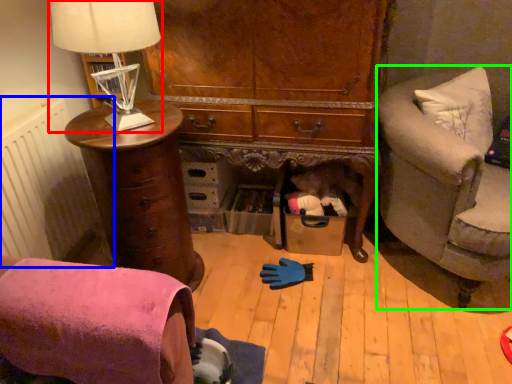
Question: Based on their relative distances, which object is farther from table lamp (highlighted by a red box)? Choose from radiator (highlighted by a blue box) and studio couch (highlighted by a green box).

Choices:
 (A) radiator
 (B) studio couch

Answer: (B)